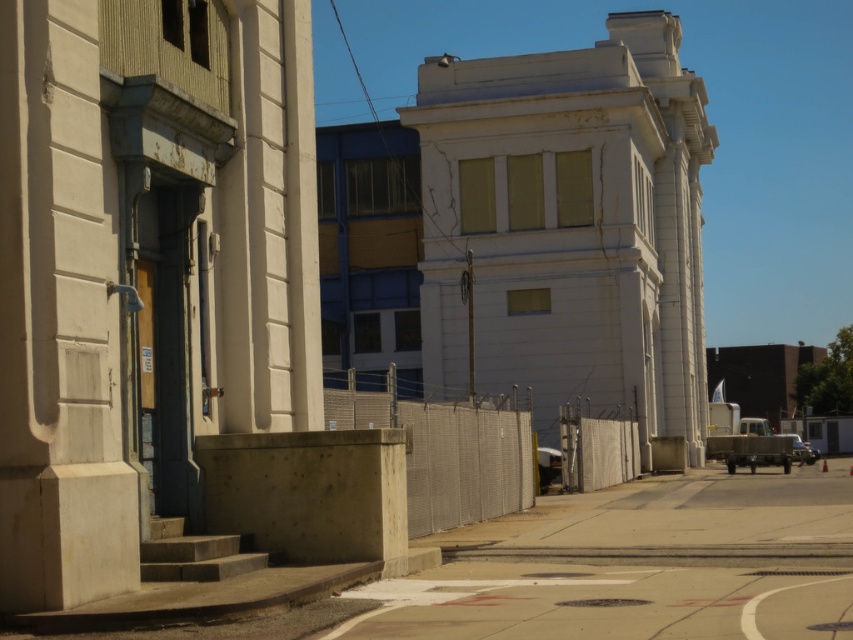
You are a delivery person trying to navigate through the urban street scene. You need to deliver a package to the beige building with steps. You see the concrete pavement at center and the white concrete pillar at left. Which object is closer to the ground?

The concrete pavement at center is located below the white concrete pillar at left, so the concrete pavement at center is closer to the ground.

You are a delivery person trying to park your bike. The bike requires a space larger than the white concrete pillar at left. Can the concrete pavement at center accommodate your bike?

The concrete pavement at center is larger in size than the white concrete pillar at left, so yes, the concrete pavement at center can accommodate your bike since it is bigger than the required space.